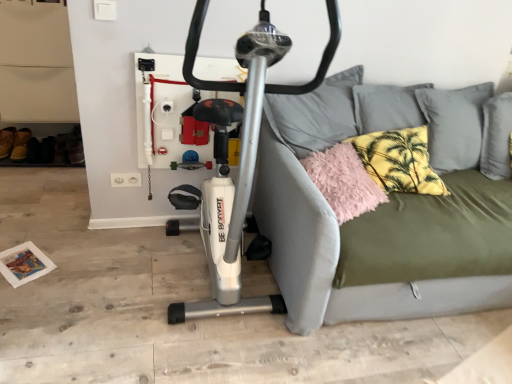
Question: From a real-world perspective, is fluffy pink pillow at right, which is counted as the first pillow, starting from the left, beneath olive green fabric studio couch at center?

Choices:
 (A) no
 (B) yes

Answer: (A)

Question: Can you see fluffy pink pillow at right, which is counted as the first pillow, starting from the left, touching olive green fabric studio couch at center?

Choices:
 (A) yes
 (B) no

Answer: (B)

Question: Considering the relative positions of fluffy pink pillow at right, the second pillow viewed from the right, and olive green fabric studio couch at center in the image provided, is fluffy pink pillow at right, the second pillow viewed from the right, behind olive green fabric studio couch at center?

Choices:
 (A) no
 (B) yes

Answer: (B)

Question: From the image's perspective, is fluffy pink pillow at right, which is counted as the first pillow, starting from the left, located beneath olive green fabric studio couch at center?

Choices:
 (A) yes
 (B) no

Answer: (B)

Question: Is fluffy pink pillow at right, the second pillow viewed from the right, oriented towards olive green fabric studio couch at center?

Choices:
 (A) no
 (B) yes

Answer: (B)

Question: Does fluffy pink pillow at right, which is counted as the first pillow, starting from the left, have a greater height compared to olive green fabric studio couch at center?

Choices:
 (A) yes
 (B) no

Answer: (B)

Question: Is yellow palm-patterned pillow at upper right, the 2th pillow in the left-to-right sequence, directly adjacent to fluffy pink pillow at right, the second pillow viewed from the right?

Choices:
 (A) no
 (B) yes

Answer: (A)

Question: Is yellow palm-patterned pillow at upper right, the 2th pillow in the left-to-right sequence, shorter than fluffy pink pillow at right, the second pillow viewed from the right?

Choices:
 (A) no
 (B) yes

Answer: (A)

Question: Would you consider yellow palm-patterned pillow at upper right, the 1th pillow viewed from the right, to be distant from fluffy pink pillow at right, which is counted as the first pillow, starting from the left?

Choices:
 (A) yes
 (B) no

Answer: (B)

Question: Can you confirm if yellow palm-patterned pillow at upper right, the 1th pillow viewed from the right, is wider than fluffy pink pillow at right, which is counted as the first pillow, starting from the left?

Choices:
 (A) yes
 (B) no

Answer: (B)

Question: Could fluffy pink pillow at right, the second pillow viewed from the right, be considered to be inside yellow palm-patterned pillow at upper right, the 2th pillow in the left-to-right sequence?

Choices:
 (A) no
 (B) yes

Answer: (A)

Question: Can we say yellow palm-patterned pillow at upper right, the 1th pillow viewed from the right, lies outside fluffy pink pillow at right, the second pillow viewed from the right?

Choices:
 (A) yes
 (B) no

Answer: (A)

Question: Can you confirm if olive green fabric studio couch at center is taller than fluffy pink pillow at right, the second pillow viewed from the right?

Choices:
 (A) no
 (B) yes

Answer: (B)